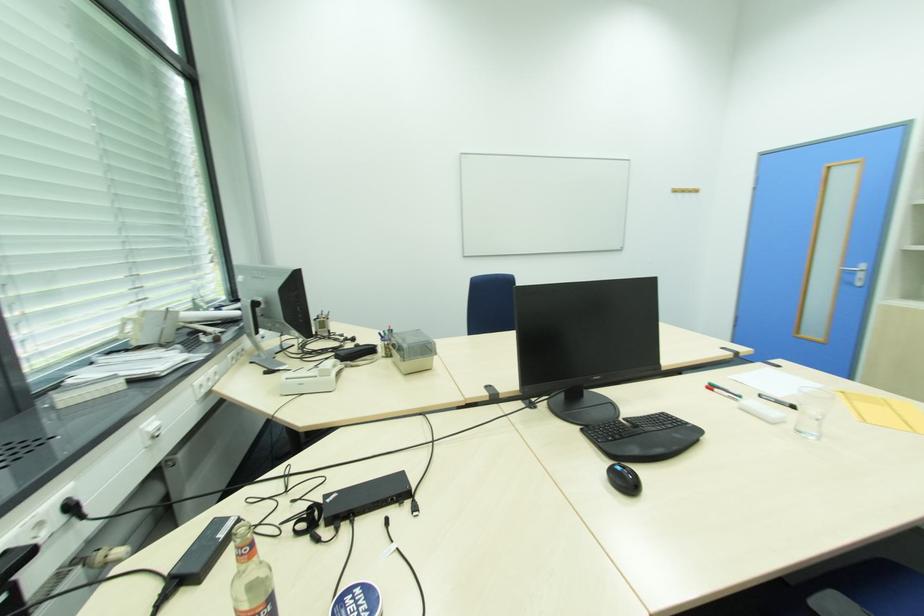
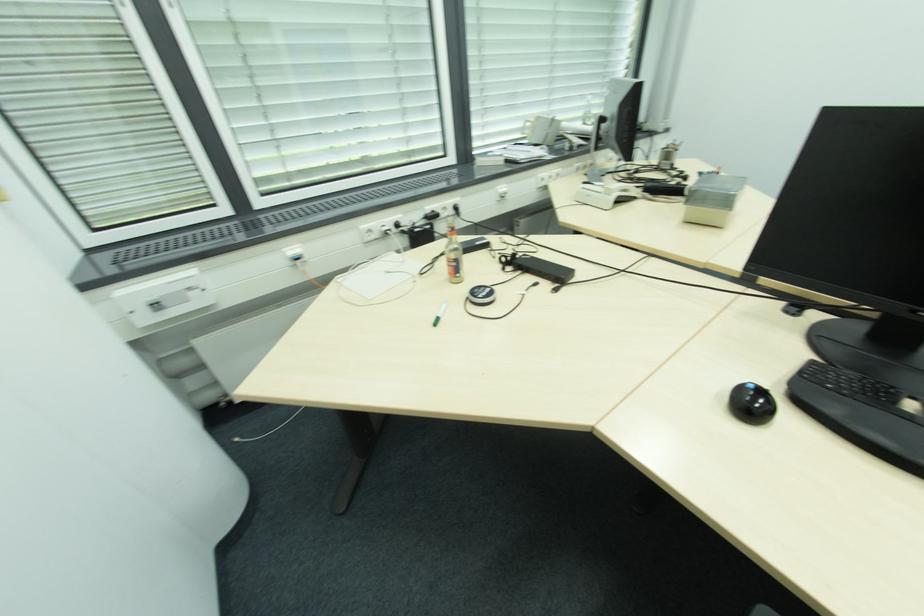
The first image is from the beginning of the video and the second image is from the end. How did the camera likely rotate when shooting the video?

The camera's rotation is toward left-down.